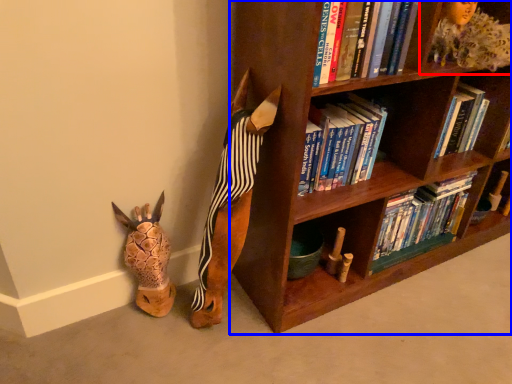
Question: Among these objects, which one is nearest to the camera, shelf (highlighted by a red box) or bookcase (highlighted by a blue box)?

Choices:
 (A) shelf
 (B) bookcase

Answer: (B)